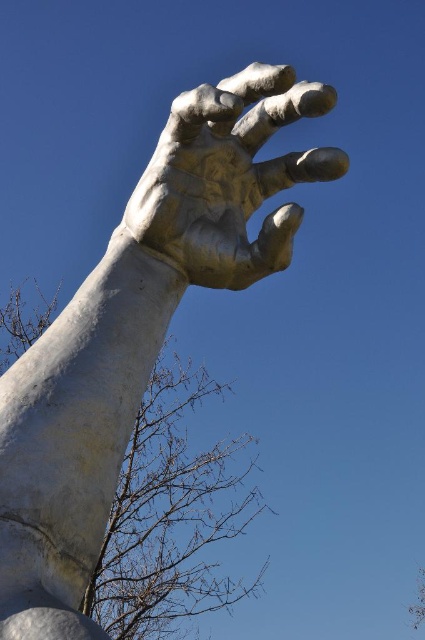
Question: Does white stone hand at upper center appear on the left side of brown leafless branches at lower left?

Choices:
 (A) yes
 (B) no

Answer: (B)

Question: Can you confirm if white stone hand at upper center is positioned above brown leafless branches at lower left?

Choices:
 (A) yes
 (B) no

Answer: (A)

Question: Which of the following is the closest to the observer?

Choices:
 (A) white stone hand at upper center
 (B) brown leafless branches at lower left
 (C) gold polished hand at center

Answer: (A)

Question: Estimate the real-world distances between objects in this image. Which object is farther from the brown leafless branches at lower left?

Choices:
 (A) gold polished hand at center
 (B) white stone hand at upper center

Answer: (B)

Question: Can you confirm if white stone hand at upper center is smaller than brown leafless branches at lower left?

Choices:
 (A) yes
 (B) no

Answer: (A)

Question: Which is farther from the brown leafless branches at lower left?

Choices:
 (A) gold polished hand at center
 (B) white stone hand at upper center

Answer: (B)